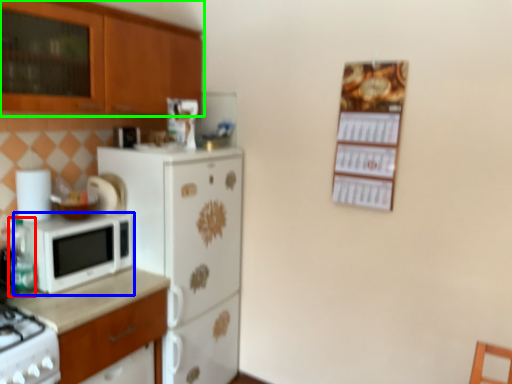
Question: Considering the real-world distances, which object is closest to bottle (highlighted by a red box)? microwave oven (highlighted by a blue box) or cabinetry (highlighted by a green box).

Choices:
 (A) microwave oven
 (B) cabinetry

Answer: (A)